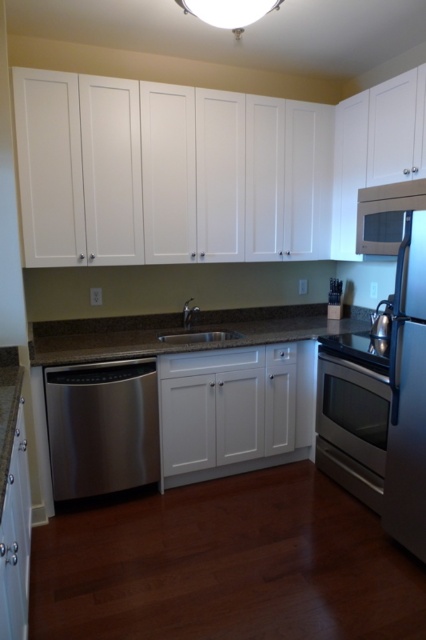
Question: Among these objects, which one is farthest from the camera?

Choices:
 (A) brown granite countertop at center
 (B) satin black oven at lower center
 (C) stainless steel sink at center

Answer: (C)

Question: Can you confirm if satin nickel exhaust hood at upper right is positioned to the left of stainless steel sink at center?

Choices:
 (A) yes
 (B) no

Answer: (B)

Question: Among these points, which one is farthest from the camera?

Choices:
 (A) (325, 349)
 (B) (380, 385)
 (C) (359, 248)
 (D) (409, 317)

Answer: (C)

Question: Can you confirm if brown granite countertop at center is bigger than stainless steel oven at lower center?

Choices:
 (A) no
 (B) yes

Answer: (B)

Question: Which object appears closest to the camera in this image?

Choices:
 (A) stainless steel dishwasher at lower left
 (B) satin nickel exhaust hood at upper right
 (C) stainless steel sink at center

Answer: (B)

Question: Can you confirm if satin black oven at lower center is smaller than stainless steel sink at center?

Choices:
 (A) no
 (B) yes

Answer: (A)